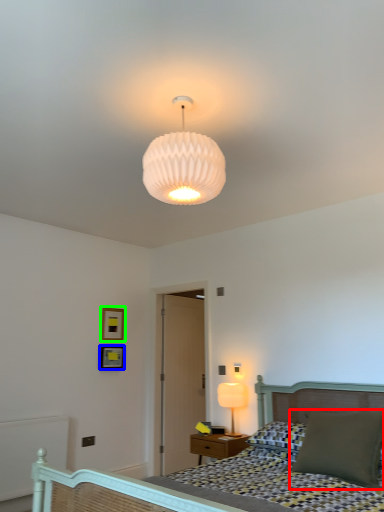
Question: Which object is the farthest from pillow (highlighted by a red box)? Choose among these: picture frame (highlighted by a blue box) or picture frame (highlighted by a green box).

Choices:
 (A) picture frame
 (B) picture frame

Answer: (B)